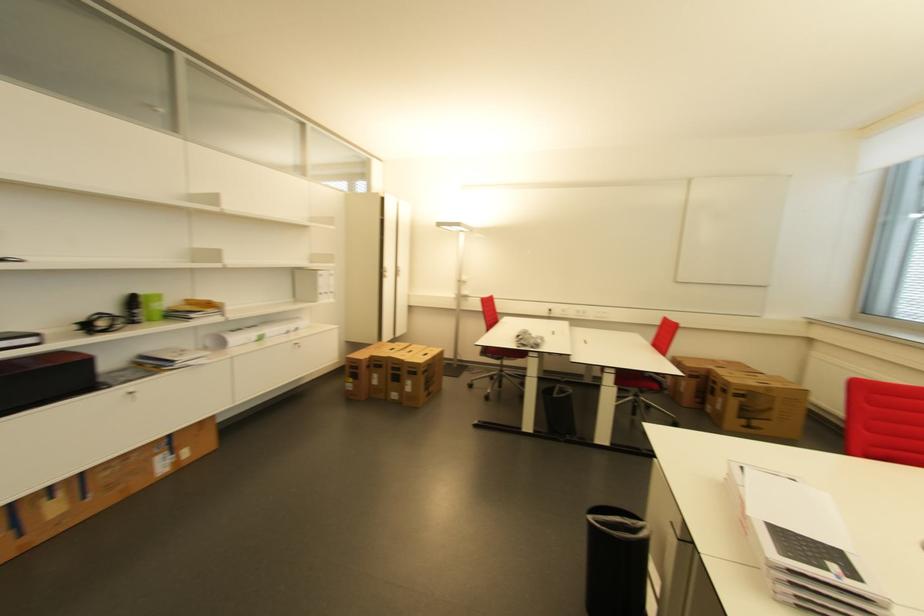
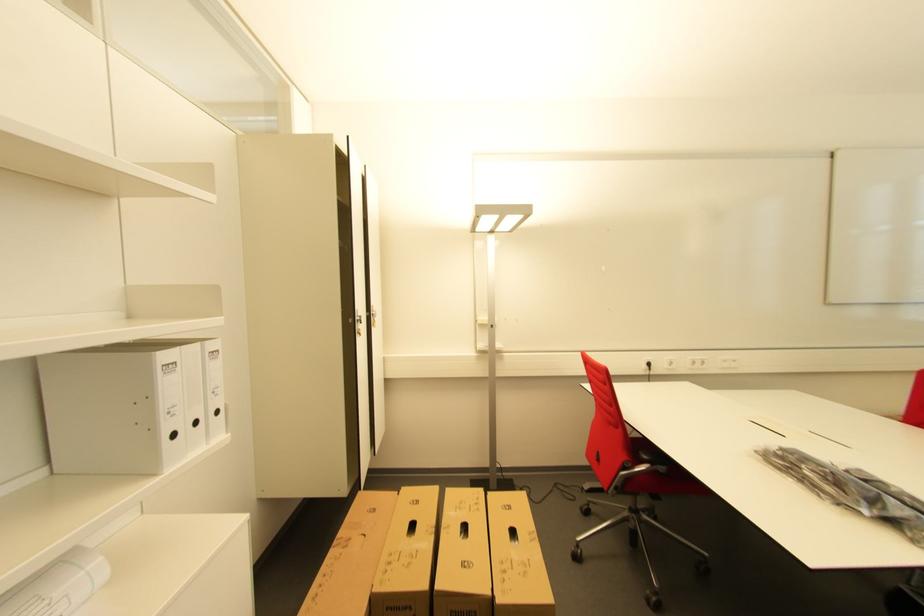
Which direction would the cameraman need to move to produce the second image?

The movement direction of the cameraman is left, forward.